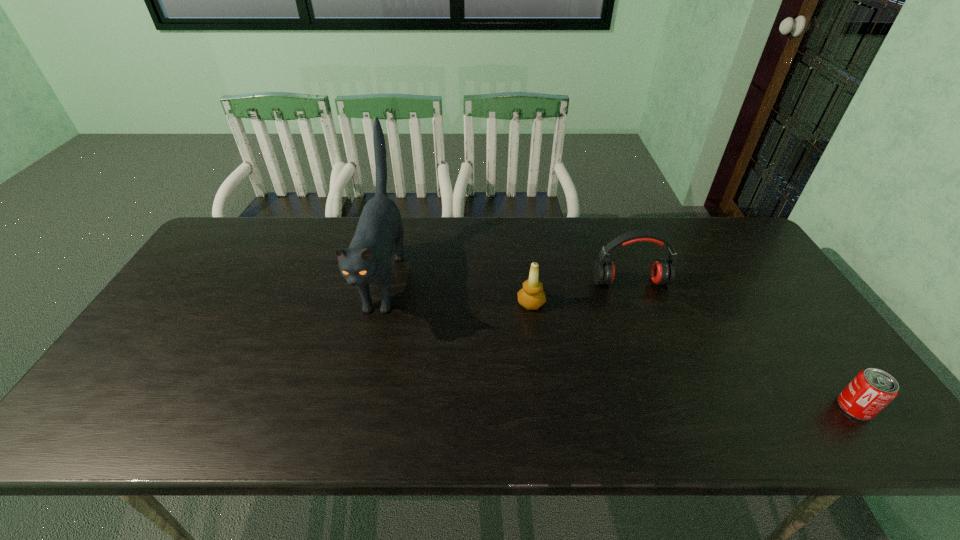
At what (x,y) coordinates should I click in order to perform the action: click on free point located on the left of the second shortest object. Please return your answer as a coordinate pair (x, y). Looking at the image, I should click on (382, 303).

The height and width of the screenshot is (540, 960). What are the coordinates of `vacant space located on the left of the can` in the screenshot? It's located at (671, 407).

Locate an element on the screen. object that is at the far edge is located at coordinates (367, 260).

I want to click on object that is at the near edge, so click(871, 390).

I want to click on object at the right edge, so click(x=871, y=390).

Find the location of a particular element. This screenshot has width=960, height=540. object that is at the near right corner is located at coordinates (871, 390).

Image resolution: width=960 pixels, height=540 pixels. I want to click on vacant region at the far edge of the desktop, so click(x=697, y=252).

Locate an element on the screen. The image size is (960, 540). free region at the near edge is located at coordinates (378, 441).

At what (x,y) coordinates should I click in order to perform the action: click on free point at the right edge. Please return your answer as a coordinate pair (x, y). Looking at the image, I should click on (766, 272).

Locate an element on the screen. free space at the far left corner of the desktop is located at coordinates (239, 219).